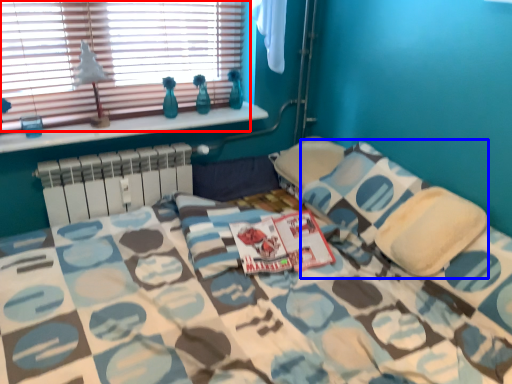
Question: Which point is further to the camera, window (highlighted by a red box) or pillow (highlighted by a blue box)?

Choices:
 (A) window
 (B) pillow

Answer: (A)